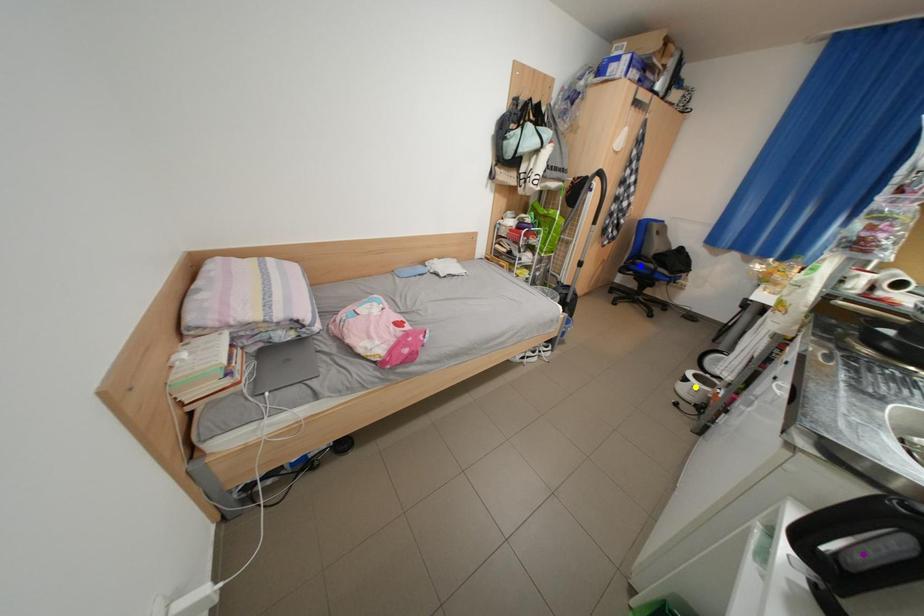
Order these from farthest to nearest:
A) yellow point
B) purple point
C) blue point

blue point < yellow point < purple point